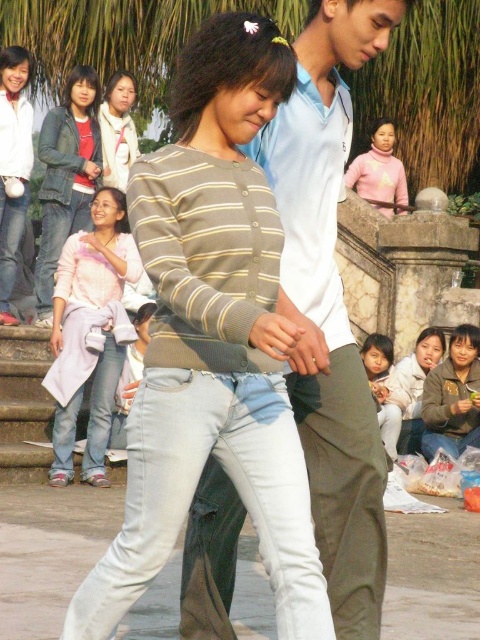
Question: Which object appears closest to the camera in this image?

Choices:
 (A) light pink fabric at lower right
 (B) white matte shirt at upper left
 (C) light brown sweater at upper center
 (D) light blue denim jeans at center

Answer: (D)

Question: Observing the image, what is the correct spatial positioning of pink fabric shirt at left in reference to gray fleece jacket at lower right?

Choices:
 (A) left
 (B) right

Answer: (A)

Question: Considering the relative positions of pink cotton shirt at upper center and light pink fabric at lower right in the image provided, where is pink cotton shirt at upper center located with respect to light pink fabric at lower right?

Choices:
 (A) below
 (B) above

Answer: (B)

Question: Which of these objects is positioned farthest from the light pink fabric at lower right?

Choices:
 (A) pink fabric shirt at left
 (B) gray fleece jacket at lower right
 (C) light blue cotton shirt at center

Answer: (C)

Question: Which of the following is the farthest from the observer?

Choices:
 (A) (97, 580)
 (B) (76, 152)
 (C) (344, 394)

Answer: (B)

Question: Can you confirm if matte pink sweater at upper left is positioned below light brown sweater at upper center?

Choices:
 (A) no
 (B) yes

Answer: (B)